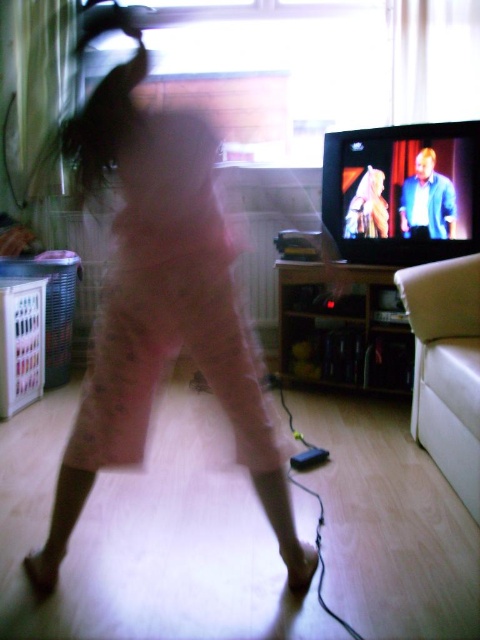
Can you confirm if pink fabric skirt at center is wider than matte plastic tv at upper right?

Yes.

Can you confirm if pink fabric skirt at center is thinner than matte plastic tv at upper right?

In fact, pink fabric skirt at center might be wider than matte plastic tv at upper right.

Is point (257, 406) farther from camera compared to point (439, 182)?

No.

Find the location of a particular element. Image resolution: width=480 pixels, height=640 pixels. pink fabric skirt at center is located at coordinates (157, 301).